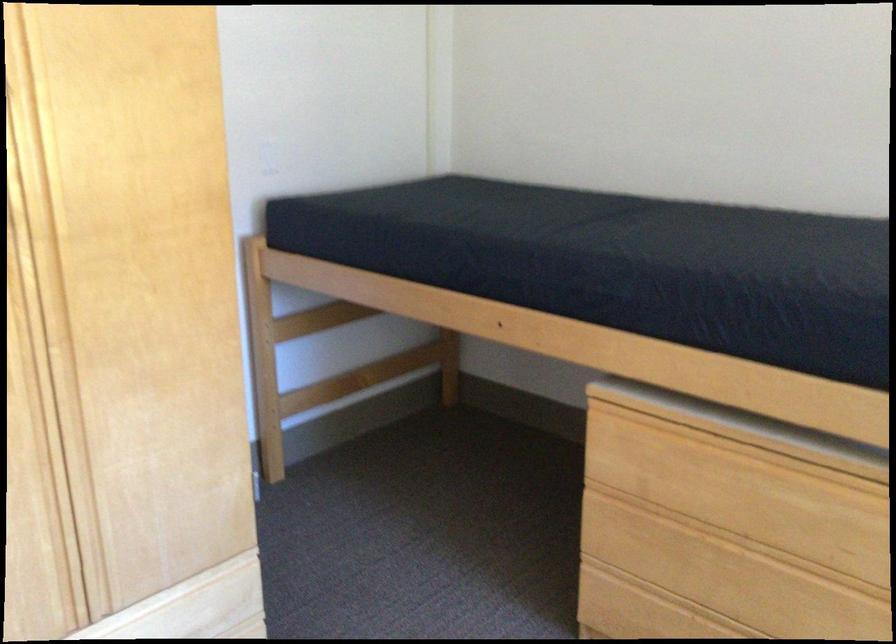
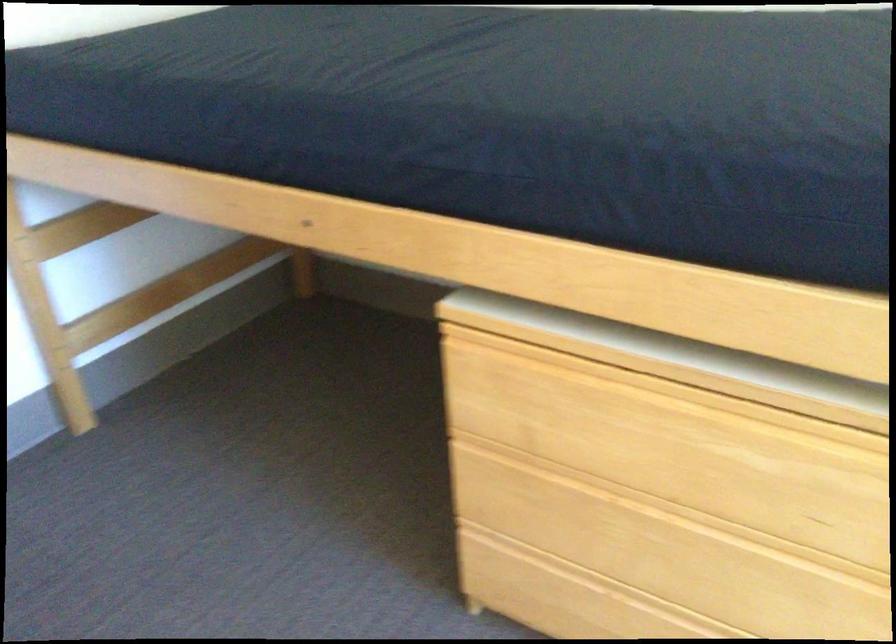
Question: Based on the continuous images, in which direction is the camera rotating? Reply with the corresponding letter.

Choices:
 (A) Left
 (B) Right
 (C) Up
 (D) Down

Answer: (D)